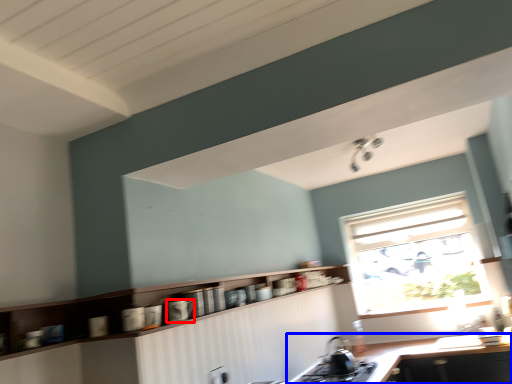
Question: Which point is further to the camera, appliance (highlighted by a red box) or countertop (highlighted by a blue box)?

Choices:
 (A) appliance
 (B) countertop

Answer: (B)